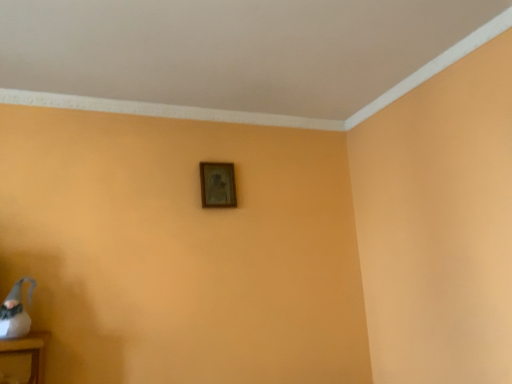
What is the approximate width of wooden frame at upper center?

2.88 inches.

What do you see at coordinates (217, 185) in the screenshot?
I see `wooden frame at upper center` at bounding box center [217, 185].

Locate an element on the screen. The width and height of the screenshot is (512, 384). wooden frame at upper center is located at coordinates (217, 185).

Find the location of a particular element. This screenshot has width=512, height=384. wooden frame at upper center is located at coordinates (217, 185).